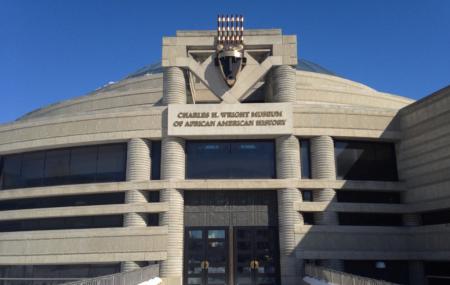
Find the location of a particular element. This screenshot has height=285, width=450. left door is located at coordinates (208, 256).